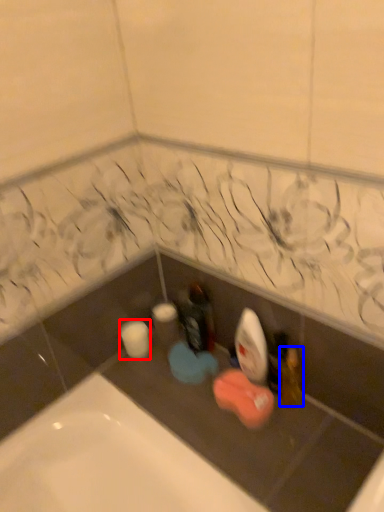
Question: Which point is further to the camera, toilet paper (highlighted by a red box) or toiletry (highlighted by a blue box)?

Choices:
 (A) toilet paper
 (B) toiletry

Answer: (A)